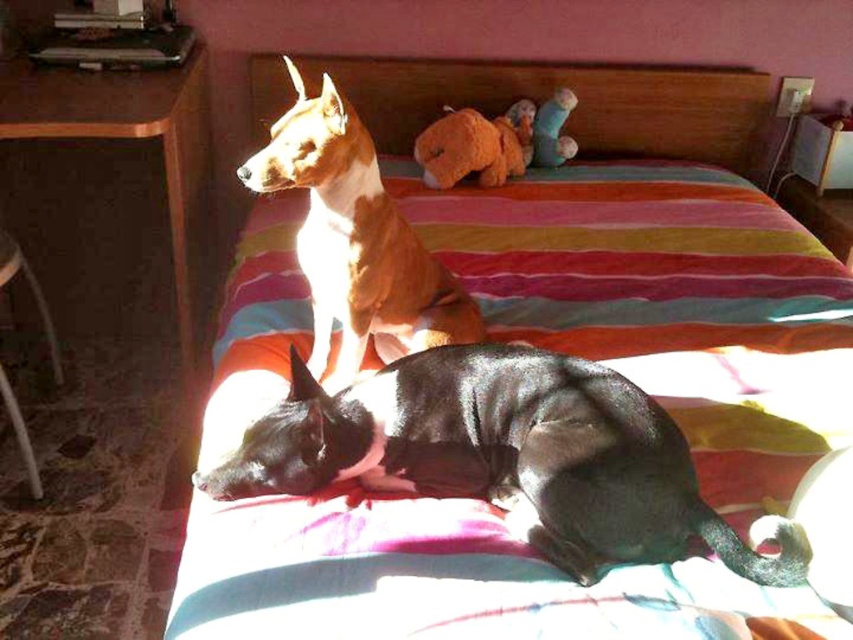
You are a dog owner who wants to ensure both dogs have enough space to rest comfortably. Given that the recommended minimum distance between dogs for comfort is 12 inches, can the black smooth dog at center and the brown glossy dog at upper center maintain this distance?

The distance between the black smooth dog at center and the brown glossy dog at upper center is 12.38 inches, which exceeds the recommended minimum of 12 inches. Therefore, they can maintain the required distance comfortably.

You are a dog owner who wants to place a new toy between the black smooth dog at center and the brown glossy dog at upper center. Based on their positions, where should you place the toy so it is accessible to both dogs?

The black smooth dog at center is positioned under the brown glossy dog at upper center, so placing the toy between them would require positioning it below the brown glossy dog at upper center and above the black smooth dog at center to ensure both can reach it.

You are a dog owner who wants to ensure both dogs have enough space to rest comfortably on the striped fabric bed at center. Given that the brown glossy dog at upper center is smaller than the bed, can you confirm if there is sufficient space for both dogs?

The striped fabric bed at center has a larger size compared to the brown glossy dog at upper center, so yes, there is enough space for both dogs to rest comfortably on the bed.